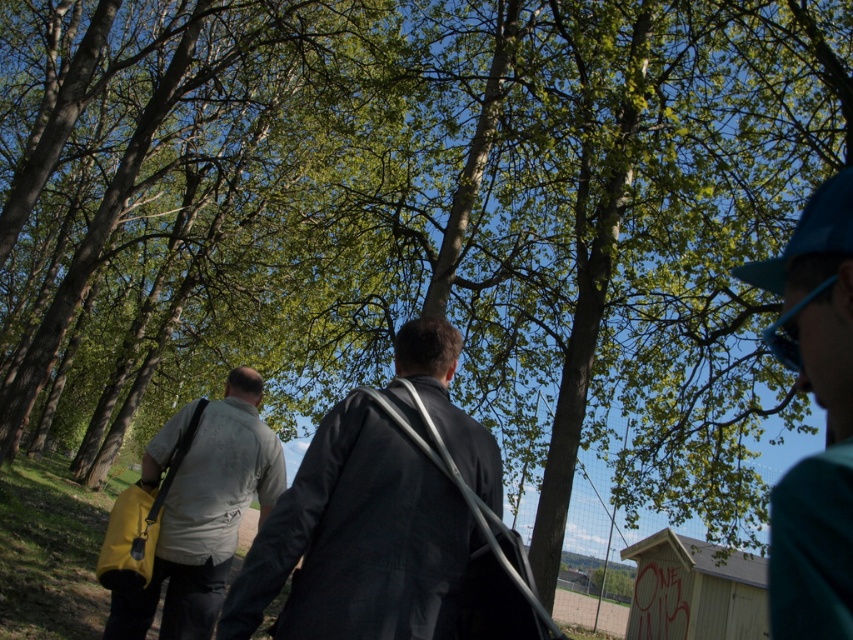
Question: Is dark gray suit at center to the right of teal fabric cap at upper right from the viewer's perspective?

Choices:
 (A) no
 (B) yes

Answer: (A)

Question: Does light gray fabric shirt at center have a smaller size compared to blue fabric baseball cap at upper right?

Choices:
 (A) no
 (B) yes

Answer: (A)

Question: Considering the relative positions of teal fabric cap at upper right and blue fabric baseball cap at upper right in the image provided, where is teal fabric cap at upper right located with respect to blue fabric baseball cap at upper right?

Choices:
 (A) above
 (B) below

Answer: (B)

Question: Which object appears closest to the camera in this image?

Choices:
 (A) dark gray suit at center
 (B) light gray fabric shirt at center
 (C) blue fabric baseball cap at upper right
 (D) teal fabric cap at upper right

Answer: (D)

Question: Which point appears closest to the camera in this image?

Choices:
 (A) (207, 515)
 (B) (819, 248)
 (C) (465, 464)
 (D) (833, 541)

Answer: (D)

Question: Which object appears closest to the camera in this image?

Choices:
 (A) blue fabric baseball cap at upper right
 (B) light gray fabric shirt at center
 (C) teal fabric cap at upper right

Answer: (C)